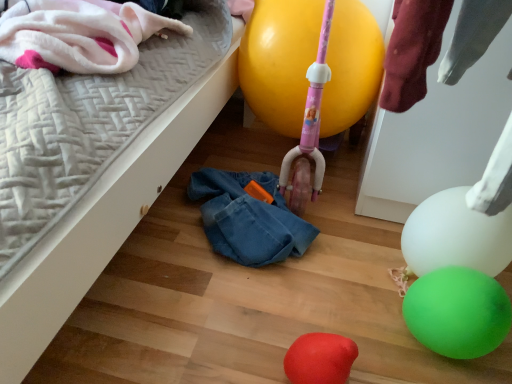
What is the approximate width of rubber balloon at lower center, the first balloon ordered from the bottom?

rubber balloon at lower center, the first balloon ordered from the bottom, is 4.76 inches wide.

The width and height of the screenshot is (512, 384). Identify the location of rubber balloon at lower center, the first balloon ordered from the bottom. (320, 359).

What do you see at coordinates (458, 312) in the screenshot?
I see `green rubber balloon at lower right, the 2th balloon from the bottom` at bounding box center [458, 312].

Locate an element on the screen. Image resolution: width=512 pixels, height=384 pixels. yellow rubber balloon at center, the 4th balloon from the bottom is located at coordinates (279, 60).

This screenshot has height=384, width=512. Find the location of `balloon that is the 4th one when counting downward from the fluffy white blanket at upper left (from the image's perspective)`. balloon that is the 4th one when counting downward from the fluffy white blanket at upper left (from the image's perspective) is located at coordinates (320, 359).

Between fluffy white blanket at upper left and rubber balloon at lower center, which is the fourth balloon from top to bottom, which one has more height?

With more height is fluffy white blanket at upper left.

From a real-world perspective, is fluffy white blanket at upper left positioned above or below rubber balloon at lower center, the first balloon ordered from the bottom?

From a real-world perspective, fluffy white blanket at upper left is physically above rubber balloon at lower center, the first balloon ordered from the bottom.

Is white glossy balloon at lower right, marked as the second balloon in a top-to-bottom arrangement, in contact with green rubber balloon at lower right, the third balloon in the top-to-bottom sequence?

They are not placed beside each other.

Which object is closer to the camera, white glossy balloon at lower right, the third balloon positioned from the bottom, or green rubber balloon at lower right, the 2th balloon from the bottom?

green rubber balloon at lower right, the 2th balloon from the bottom, is closer to the camera.

Does white glossy balloon at lower right, the third balloon positioned from the bottom, have a greater width compared to green rubber balloon at lower right, the third balloon in the top-to-bottom sequence?

Correct, the width of white glossy balloon at lower right, the third balloon positioned from the bottom, exceeds that of green rubber balloon at lower right, the third balloon in the top-to-bottom sequence.

Does fluffy white blanket at upper left have a lesser width compared to green rubber balloon at lower right, the third balloon in the top-to-bottom sequence?

In fact, fluffy white blanket at upper left might be wider than green rubber balloon at lower right, the third balloon in the top-to-bottom sequence.

Which point is more distant from viewer, (135,28) or (483,294)?

Positioned behind is point (135,28).

From the fluffy white blanket at upper left, count 1st balloons forward and point to it. Please provide its 2D coordinates.

[(458, 312)]

Considering the sizes of objects fluffy white blanket at upper left and green rubber balloon at lower right, the third balloon in the top-to-bottom sequence, in the image provided, who is taller, fluffy white blanket at upper left or green rubber balloon at lower right, the third balloon in the top-to-bottom sequence,?

Standing taller between the two is green rubber balloon at lower right, the third balloon in the top-to-bottom sequence.

Is yellow rubber balloon at center, the 4th balloon from the bottom, oriented away from rubber balloon at lower center, the first balloon ordered from the bottom?

No, yellow rubber balloon at center, the 4th balloon from the bottom, is not facing away from rubber balloon at lower center, the first balloon ordered from the bottom.

From a real-world perspective, is yellow rubber balloon at center, the 4th balloon from the bottom, on top of rubber balloon at lower center, which is the fourth balloon from top to bottom?

Yes.

Is point (270, 51) closer or farther from the camera than point (325, 375)?

Point (270, 51) appears to be farther away from the viewer than point (325, 375).

How much distance is there between yellow rubber balloon at center, the 1th balloon viewed from the top, and rubber balloon at lower center, the first balloon ordered from the bottom?

yellow rubber balloon at center, the 1th balloon viewed from the top, and rubber balloon at lower center, the first balloon ordered from the bottom, are 24.57 inches apart.

Could you tell me if fluffy white blanket at upper left is turned towards yellow rubber balloon at center, the 4th balloon from the bottom?

No, fluffy white blanket at upper left is not oriented towards yellow rubber balloon at center, the 4th balloon from the bottom.

Considering the positions of objects fluffy white blanket at upper left and yellow rubber balloon at center, the 1th balloon viewed from the top, in the image provided, who is behind, fluffy white blanket at upper left or yellow rubber balloon at center, the 1th balloon viewed from the top,?

yellow rubber balloon at center, the 1th balloon viewed from the top, is more distant.

The width and height of the screenshot is (512, 384). What are the coordinates of `clothing that is above the yellow rubber balloon at center, the 4th balloon from the bottom (from the image's perspective)` in the screenshot? It's located at (79, 34).

Based on the photo, from a real-world perspective, who is located higher, rubber balloon at lower center, the first balloon ordered from the bottom, or green rubber balloon at lower right, the third balloon in the top-to-bottom sequence?

In real-world perspective, green rubber balloon at lower right, the third balloon in the top-to-bottom sequence, is above.

From the image's perspective, would you say rubber balloon at lower center, the first balloon ordered from the bottom, is shown under green rubber balloon at lower right, the third balloon in the top-to-bottom sequence?

Yes, from the image's perspective, rubber balloon at lower center, the first balloon ordered from the bottom, is below green rubber balloon at lower right, the third balloon in the top-to-bottom sequence.

Who is more distant, rubber balloon at lower center, which is the fourth balloon from top to bottom, or green rubber balloon at lower right, the third balloon in the top-to-bottom sequence?

green rubber balloon at lower right, the third balloon in the top-to-bottom sequence, is behind.

Considering the sizes of objects rubber balloon at lower center, the first balloon ordered from the bottom, and green rubber balloon at lower right, the 2th balloon from the bottom, in the image provided, who is wider, rubber balloon at lower center, the first balloon ordered from the bottom, or green rubber balloon at lower right, the 2th balloon from the bottom,?

Wider between the two is green rubber balloon at lower right, the 2th balloon from the bottom.

Considering the sizes of yellow rubber balloon at center, the 1th balloon viewed from the top, and fluffy white blanket at upper left in the image, is yellow rubber balloon at center, the 1th balloon viewed from the top, bigger or smaller than fluffy white blanket at upper left?

In the image, yellow rubber balloon at center, the 1th balloon viewed from the top, appears to be smaller than fluffy white blanket at upper left.

From a real-world perspective, relative to fluffy white blanket at upper left, is yellow rubber balloon at center, the 4th balloon from the bottom, vertically above or below?

yellow rubber balloon at center, the 4th balloon from the bottom, is situated lower than fluffy white blanket at upper left in the real world.

Is yellow rubber balloon at center, the 4th balloon from the bottom, facing away from fluffy white blanket at upper left?

yellow rubber balloon at center, the 4th balloon from the bottom, does not have its back to fluffy white blanket at upper left.

Can you confirm if yellow rubber balloon at center, the 4th balloon from the bottom, is shorter than fluffy white blanket at upper left?

In fact, yellow rubber balloon at center, the 4th balloon from the bottom, may be taller than fluffy white blanket at upper left.

Where is `balloon that is the 4th object located below the fluffy white blanket at upper left (from the image's perspective)`? balloon that is the 4th object located below the fluffy white blanket at upper left (from the image's perspective) is located at coordinates (320, 359).

Starting from the white glossy balloon at lower right, marked as the second balloon in a top-to-bottom arrangement, which balloon is the 1st one to the left? Please provide its 2D coordinates.

[(458, 312)]

Which object lies nearer to the anchor point yellow rubber balloon at center, the 4th balloon from the bottom, green rubber balloon at lower right, the 2th balloon from the bottom, or fluffy white blanket at upper left?

The object closer to yellow rubber balloon at center, the 4th balloon from the bottom, is fluffy white blanket at upper left.

Which object lies further to the anchor point white glossy balloon at lower right, the third balloon positioned from the bottom, rubber balloon at lower center, the first balloon ordered from the bottom, or yellow rubber balloon at center, the 4th balloon from the bottom?

The object further to white glossy balloon at lower right, the third balloon positioned from the bottom, is yellow rubber balloon at center, the 4th balloon from the bottom.

From the image, which object appears to be nearer to rubber balloon at lower center, which is the fourth balloon from top to bottom, yellow rubber balloon at center, the 4th balloon from the bottom, or fluffy white blanket at upper left?

Based on the image, yellow rubber balloon at center, the 4th balloon from the bottom, appears to be nearer to rubber balloon at lower center, which is the fourth balloon from top to bottom.

Estimate the real-world distances between objects in this image. Which object is closer to green rubber balloon at lower right, the third balloon in the top-to-bottom sequence, fluffy white blanket at upper left or white glossy balloon at lower right, the third balloon positioned from the bottom?

white glossy balloon at lower right, the third balloon positioned from the bottom, is closer to green rubber balloon at lower right, the third balloon in the top-to-bottom sequence.

From the image, which object appears to be nearer to fluffy white blanket at upper left, green rubber balloon at lower right, the third balloon in the top-to-bottom sequence, or rubber balloon at lower center, the first balloon ordered from the bottom?

rubber balloon at lower center, the first balloon ordered from the bottom, is positioned closer to the anchor fluffy white blanket at upper left.

Looking at this image, from the image, which object appears to be nearer to yellow rubber balloon at center, the 1th balloon viewed from the top, white glossy balloon at lower right, the third balloon positioned from the bottom, or green rubber balloon at lower right, the 2th balloon from the bottom?

The object closer to yellow rubber balloon at center, the 1th balloon viewed from the top, is white glossy balloon at lower right, the third balloon positioned from the bottom.

Based on their spatial positions, is rubber balloon at lower center, which is the fourth balloon from top to bottom, or fluffy white blanket at upper left closer to white glossy balloon at lower right, the third balloon positioned from the bottom?

rubber balloon at lower center, which is the fourth balloon from top to bottom, is positioned closer to the anchor white glossy balloon at lower right, the third balloon positioned from the bottom.

When comparing their distances from rubber balloon at lower center, which is the fourth balloon from top to bottom, does yellow rubber balloon at center, the 4th balloon from the bottom, or white glossy balloon at lower right, marked as the second balloon in a top-to-bottom arrangement, seem further?

Among the two, yellow rubber balloon at center, the 4th balloon from the bottom, is located further to rubber balloon at lower center, which is the fourth balloon from top to bottom.

What are the coordinates of `balloon between yellow rubber balloon at center, the 4th balloon from the bottom, and green rubber balloon at lower right, the 2th balloon from the bottom, from top to bottom` in the screenshot? It's located at (456, 235).

The height and width of the screenshot is (384, 512). What are the coordinates of `balloon between rubber balloon at lower center, which is the fourth balloon from top to bottom, and white glossy balloon at lower right, the third balloon positioned from the bottom, from left to right` in the screenshot? It's located at (458, 312).